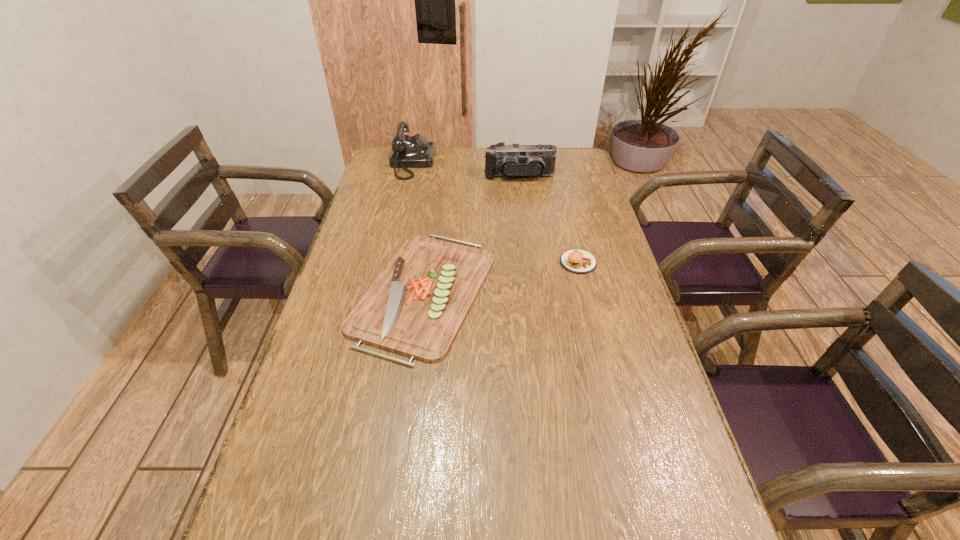
Locate an element on the screen. This screenshot has height=540, width=960. telephone is located at coordinates point(416,151).

Identify the location of camcorder. Image resolution: width=960 pixels, height=540 pixels. (534, 161).

Where is `patty`? patty is located at coordinates (578, 261).

At what (x,y) coordinates should I click in order to perform the action: click on the shortest object. Please return your answer as a coordinate pair (x, y). This screenshot has width=960, height=540. Looking at the image, I should click on (417, 305).

This screenshot has width=960, height=540. I want to click on vacant space located 0.180m on the dial of the telephone, so click(477, 163).

Locate an element on the screen. free space located 0.260m on the front-facing side of the camcorder is located at coordinates (525, 222).

I want to click on blank space located 0.050m on the front of the second shortest object, so point(584,286).

Locate an element on the screen. The image size is (960, 540). blank space located 0.340m on the back of the chopping board is located at coordinates (439, 183).

This screenshot has width=960, height=540. Identify the location of telephone at the far edge. (416, 151).

I want to click on camcorder at the far edge, so click(534, 161).